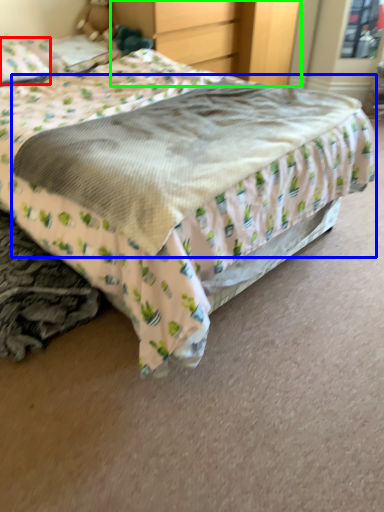
Question: Considering the real-world distances, which object is closest to pillow (highlighted by a red box)? mattress (highlighted by a blue box) or dresser (highlighted by a green box).

Choices:
 (A) mattress
 (B) dresser

Answer: (B)